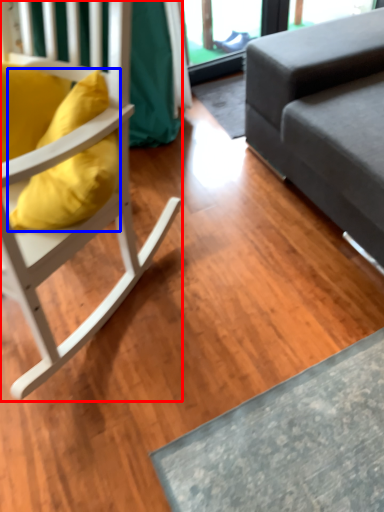
Question: Which object is further to the camera taking this photo, chair (highlighted by a red box) or pillow (highlighted by a blue box)?

Choices:
 (A) chair
 (B) pillow

Answer: (B)